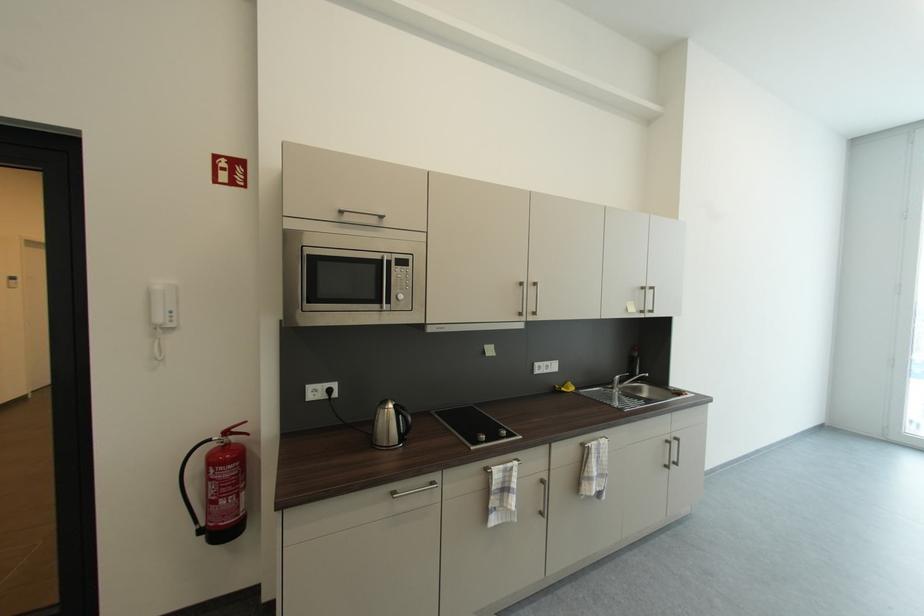
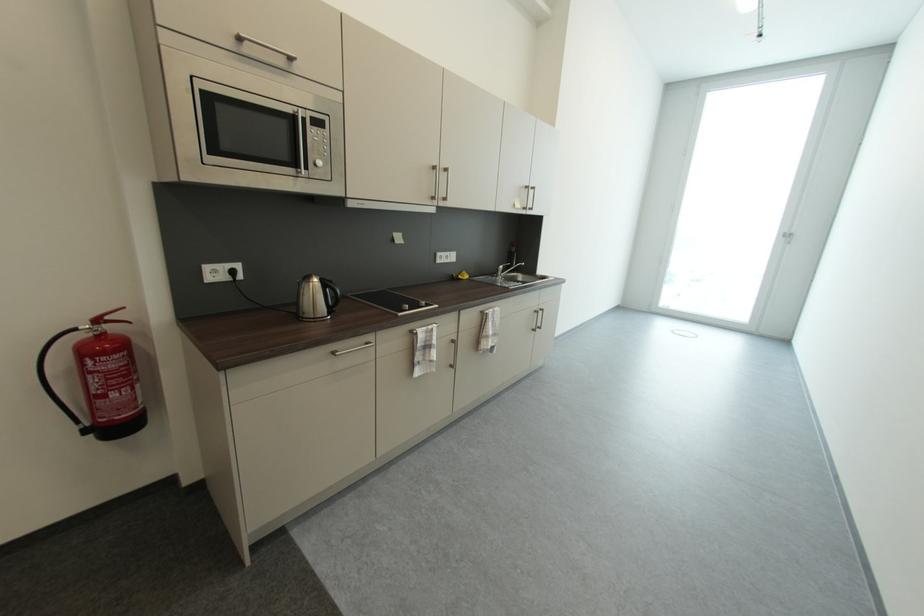
Which direction would the cameraman need to move to produce the second image?

The movement direction of the cameraman is left, backward.